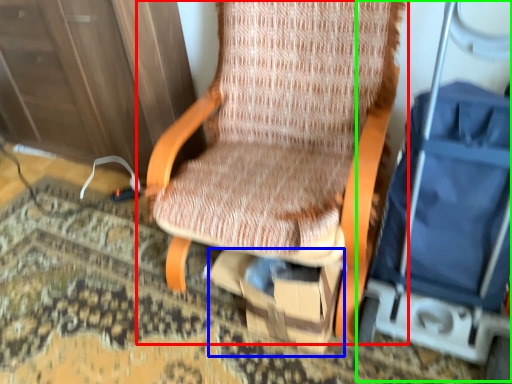
Question: Considering the real-world distances, which object is closest to chair (highlighted by a red box)? cardboard box (highlighted by a blue box) or baby carriage (highlighted by a green box).

Choices:
 (A) cardboard box
 (B) baby carriage

Answer: (A)